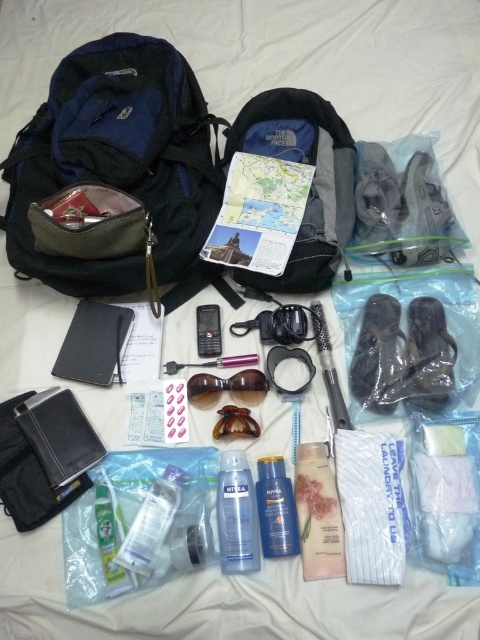
You are packing for a trip and see the browny amber plastic goggles at center and the clear plastic hairbrush at center on the travel items layout. Which item is positioned lower relative to the other?

The browny amber plastic goggles at center is below the clear plastic hairbrush at center, so it is positioned lower.

Looking at this image, you are standing 5 feet away from the white surface. Is the point at coordinates point (295, 260) closer to you than the edge of the map?

The point at coordinates point (295, 260) is 3.68 feet from the viewer. Since you are standing 5 feet away from the white surface, the point is closer to you than the edge of the map.

You are packing for a trip and need to place the browny amber plastic goggles at center into a backpack. Which backpack should you choose, the one on the left or the one on the right, based on their positions relative to the goggles?

The larger backpack on the left is closer to the browny amber plastic goggles at center, so you should choose the backpack on the left to place the goggles into.